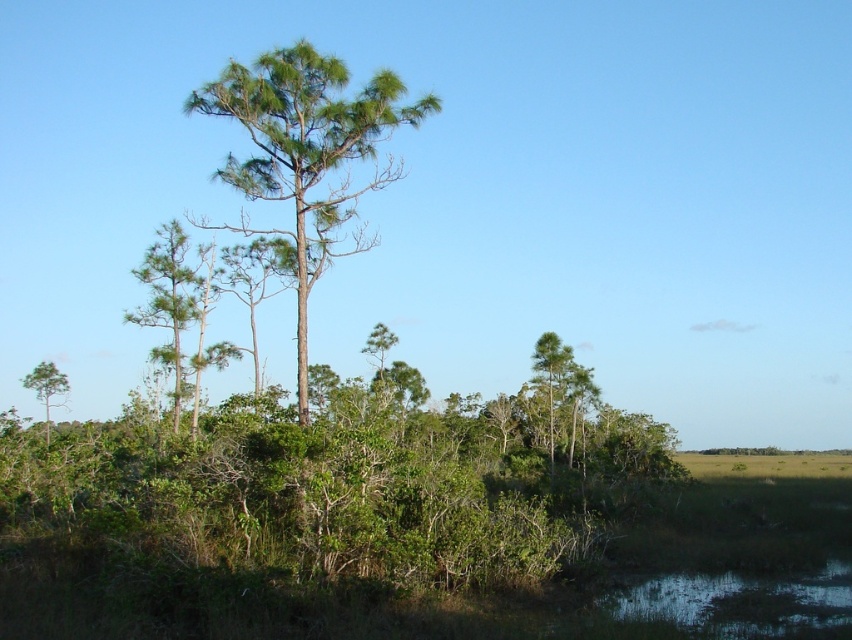
From the picture: You are standing in the middle of the forest depicted in the scene. You notice a point marked at coordinates (738, 598). What is located at this point?

The point at coordinates (738, 598) marks greenish reflective water at lower right.

From the picture: You are standing in the middle of the scene and want to walk to the green leafy tree at lower left. Is the greenish reflective water at lower right blocking your path?

The greenish reflective water at lower right is positioned over the green leafy tree at lower left, so it is blocking the path to the green leafy tree at lower left.